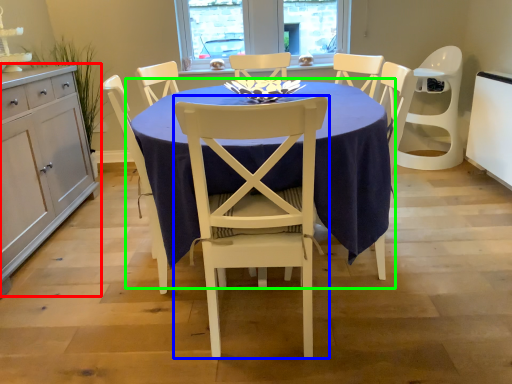
Question: Considering the real-world distances, which object is closest to cabinetry (highlighted by a red box)? chair (highlighted by a blue box) or kitchen & dining room table (highlighted by a green box).

Choices:
 (A) chair
 (B) kitchen & dining room table

Answer: (B)